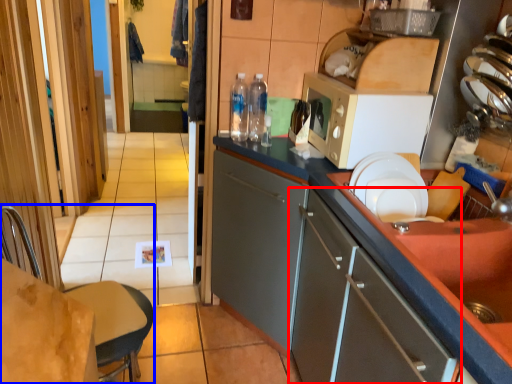
Question: Which object is closer to the camera taking this photo, cabinetry (highlighted by a red box) or chair (highlighted by a blue box)?

Choices:
 (A) cabinetry
 (B) chair

Answer: (A)